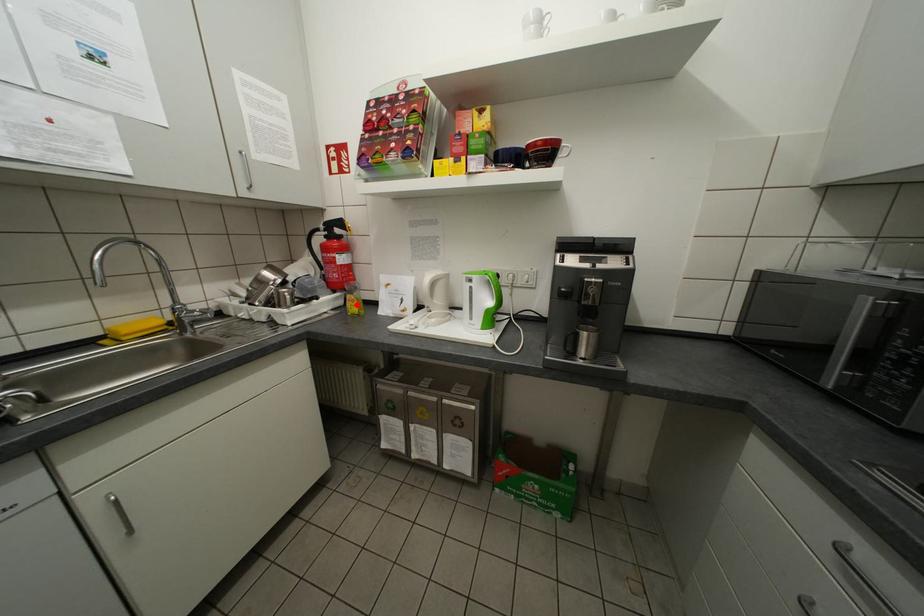
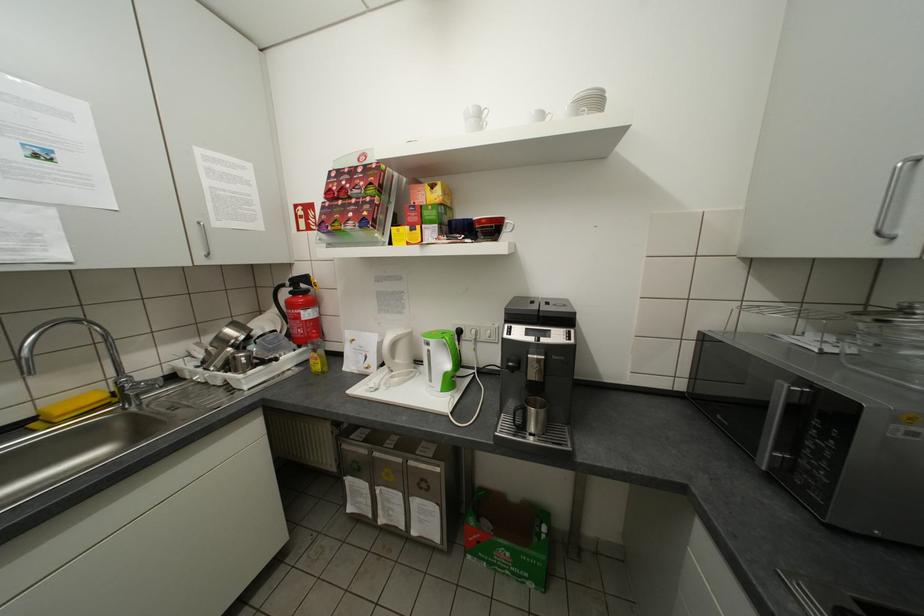
Find the pixel in the second image that matches the highlighted location in the first image.

(321, 362)